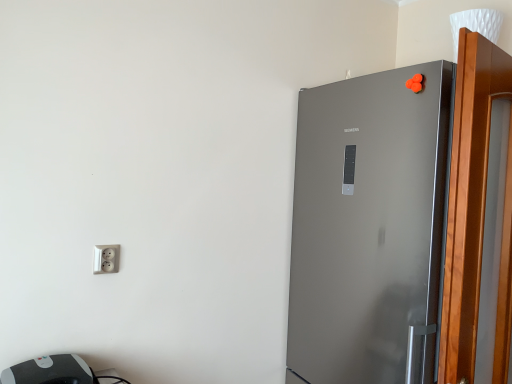
This screenshot has width=512, height=384. I want to click on silver metallic socket at lower left, so click(x=106, y=258).

What do you see at coordinates (369, 228) in the screenshot? Image resolution: width=512 pixels, height=384 pixels. I see `satin silver refrigerator at right` at bounding box center [369, 228].

Locate an element on the screen. The image size is (512, 384). satin silver refrigerator at right is located at coordinates (369, 228).

This screenshot has width=512, height=384. Describe the element at coordinates (49, 371) in the screenshot. I see `gray plastic printer at lower left` at that location.

Looking at this image, what is the approximate width of gray plastic printer at lower left?

It is 10.36 inches.

This screenshot has width=512, height=384. Identify the location of wooden screen door at right. (468, 199).

Find the location of a particular element. silver metallic socket at lower left is located at coordinates (106, 258).

Locate an element on the screen. This screenshot has height=384, width=512. socket below the wooden screen door at right (from a real-world perspective) is located at coordinates (106, 258).

Could you tell me if silver metallic socket at lower left is turned towards wooden screen door at right?

No, silver metallic socket at lower left does not turn towards wooden screen door at right.

Which object is thinner, silver metallic socket at lower left or wooden screen door at right?

Thinner between the two is silver metallic socket at lower left.

What's the angular difference between gray plastic printer at lower left and wooden screen door at right's facing directions?

gray plastic printer at lower left and wooden screen door at right are facing 9.5 degrees away from each other.

Which is in front, point (20, 381) or point (460, 242)?

The point (460, 242) is closer to the camera.

From a real-world perspective, is gray plastic printer at lower left physically located above or below wooden screen door at right?

gray plastic printer at lower left is below wooden screen door at right.

Is gray plastic printer at lower left aimed at wooden screen door at right?

No.

Considering the positions of objects wooden screen door at right and satin silver refrigerator at right in the image provided, who is more to the right, wooden screen door at right or satin silver refrigerator at right?

From the viewer's perspective, wooden screen door at right appears more on the right side.

Image resolution: width=512 pixels, height=384 pixels. I want to click on refrigerator on the left of the wooden screen door at right, so click(369, 228).

Does wooden screen door at right have a lesser height compared to satin silver refrigerator at right?

Indeed, wooden screen door at right has a lesser height compared to satin silver refrigerator at right.

Does gray plastic printer at lower left have a lesser height compared to silver metallic socket at lower left?

Yes.

Is gray plastic printer at lower left not within silver metallic socket at lower left?

That's correct, gray plastic printer at lower left is outside of silver metallic socket at lower left.

Does point (34, 363) come behind point (95, 271)?

No, (34, 363) is closer to viewer.

Where is `socket above the gray plastic printer at lower left (from a real-world perspective)`? socket above the gray plastic printer at lower left (from a real-world perspective) is located at coordinates (106, 258).

Is silver metallic socket at lower left not within satin silver refrigerator at right?

Yes, silver metallic socket at lower left is outside of satin silver refrigerator at right.

You are a GUI agent. You are given a task and a screenshot of the screen. Output one action in this format:
    pyautogui.click(x=<x>, y=<y>)
    Task: Click on the socket above the satin silver refrigerator at right (from the image's perspective)
    
    Given the screenshot: What is the action you would take?
    pyautogui.click(x=106, y=258)

Considering the positions of point (118, 263) and point (410, 299), is point (118, 263) closer or farther from the camera than point (410, 299)?

Point (118, 263) appears to be farther away from the viewer than point (410, 299).

Does silver metallic socket at lower left have a lesser width compared to satin silver refrigerator at right?

Indeed, silver metallic socket at lower left has a lesser width compared to satin silver refrigerator at right.

Is wooden screen door at right directly adjacent to silver metallic socket at lower left?

No, wooden screen door at right is not touching silver metallic socket at lower left.

From a real-world perspective, is wooden screen door at right below silver metallic socket at lower left?

No, from a real-world perspective, wooden screen door at right is not beneath silver metallic socket at lower left.

Considering the positions of objects wooden screen door at right and silver metallic socket at lower left in the image provided, who is more to the right, wooden screen door at right or silver metallic socket at lower left?

From the viewer's perspective, wooden screen door at right appears more on the right side.

Is wooden screen door at right facing towards silver metallic socket at lower left?

No, wooden screen door at right is not turned towards silver metallic socket at lower left.

From the image's perspective, is wooden screen door at right on top of gray plastic printer at lower left?

Yes, from the image's perspective, wooden screen door at right is above gray plastic printer at lower left.

Are wooden screen door at right and gray plastic printer at lower left located far from each other?

Indeed, wooden screen door at right is not near gray plastic printer at lower left.

Is wooden screen door at right taller than gray plastic printer at lower left?

Indeed, wooden screen door at right has a greater height compared to gray plastic printer at lower left.

Considering the relative sizes of wooden screen door at right and gray plastic printer at lower left in the image provided, is wooden screen door at right wider than gray plastic printer at lower left?

No.

The height and width of the screenshot is (384, 512). In order to click on socket lying on the left of wooden screen door at right in this screenshot , I will do `click(106, 258)`.

The width and height of the screenshot is (512, 384). I want to click on screen door on the right of gray plastic printer at lower left, so click(468, 199).

Based on their spatial positions, is gray plastic printer at lower left or silver metallic socket at lower left closer to wooden screen door at right?

silver metallic socket at lower left is closer to wooden screen door at right.

In the scene shown: From the image, which object appears to be nearer to silver metallic socket at lower left, satin silver refrigerator at right or gray plastic printer at lower left?

The object closer to silver metallic socket at lower left is gray plastic printer at lower left.

Estimate the real-world distances between objects in this image. Which object is closer to satin silver refrigerator at right, gray plastic printer at lower left or silver metallic socket at lower left?

silver metallic socket at lower left is closer to satin silver refrigerator at right.

Looking at the image, which one is located further to silver metallic socket at lower left, satin silver refrigerator at right or wooden screen door at right?

Based on the image, wooden screen door at right appears to be further to silver metallic socket at lower left.

From the image, which object appears to be nearer to satin silver refrigerator at right, silver metallic socket at lower left or gray plastic printer at lower left?

silver metallic socket at lower left is positioned closer to the anchor satin silver refrigerator at right.

Which object lies nearer to the anchor point satin silver refrigerator at right, wooden screen door at right or silver metallic socket at lower left?

wooden screen door at right is positioned closer to the anchor satin silver refrigerator at right.

When comparing their distances from silver metallic socket at lower left, does wooden screen door at right or gray plastic printer at lower left seem further?

wooden screen door at right is further to silver metallic socket at lower left.

When comparing their distances from wooden screen door at right, does satin silver refrigerator at right or gray plastic printer at lower left seem closer?

Among the two, satin silver refrigerator at right is located nearer to wooden screen door at right.

Where is `socket between gray plastic printer at lower left and satin silver refrigerator at right`? The width and height of the screenshot is (512, 384). socket between gray plastic printer at lower left and satin silver refrigerator at right is located at coordinates (106, 258).

You are a GUI agent. You are given a task and a screenshot of the screen. Output one action in this format:
    pyautogui.click(x=<x>, y=<y>)
    Task: Click on the refrigerator located between silver metallic socket at lower left and wooden screen door at right in the left-right direction
    This screenshot has width=512, height=384.
    Given the screenshot: What is the action you would take?
    tap(369, 228)

This screenshot has height=384, width=512. What are the coordinates of `socket situated between gray plastic printer at lower left and wooden screen door at right from left to right` in the screenshot? It's located at (106, 258).

Locate an element on the screen. refrigerator located between gray plastic printer at lower left and wooden screen door at right in the left-right direction is located at coordinates (369, 228).